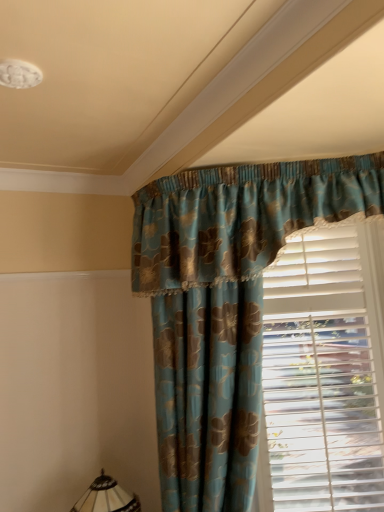
Measure the distance between point (195, 490) and camera.

A distance of 5.78 feet exists between point (195, 490) and camera.

Consider the image. In order to face white plastic blinds at right, should I rotate leftwards or rightwards?

To align with it, rotate right about 14.431°.

What do you see at coordinates (324, 373) in the screenshot? I see `white plastic blinds at right` at bounding box center [324, 373].

You are a GUI agent. You are given a task and a screenshot of the screen. Output one action in this format:
    pyautogui.click(x=<x>, y=<y>)
    Task: Click on the blue floral fabric curtain at center
    
    Given the screenshot: What is the action you would take?
    pyautogui.click(x=225, y=305)

Measure the distance between blue floral fabric curtain at center and translucent glass lampshade at lower left.

They are 34.32 inches apart.

Can you confirm if blue floral fabric curtain at center is positioned to the left of translucent glass lampshade at lower left?

No, blue floral fabric curtain at center is not to the left of translucent glass lampshade at lower left.

Which is more distant, (232, 454) or (108, 501)?

The point (108, 501) is behind.

Locate an element on the screen. This screenshot has height=512, width=384. table lamp lying behind the blue floral fabric curtain at center is located at coordinates (106, 497).

Which of these two, translucent glass lampshade at lower left or white plastic blinds at right, stands taller?

white plastic blinds at right is taller.

Considering the relative sizes of translucent glass lampshade at lower left and white plastic blinds at right in the image provided, is translucent glass lampshade at lower left smaller than white plastic blinds at right?

Yes, translucent glass lampshade at lower left is smaller than white plastic blinds at right.

Would you say translucent glass lampshade at lower left is to the left or to the right of white plastic blinds at right in the picture?

From the image, it's evident that translucent glass lampshade at lower left is to the left of white plastic blinds at right.

From a real-world perspective, which object stands above the other?

blue floral fabric curtain at center.

Can you confirm if white plastic blinds at right is wider than blue floral fabric curtain at center?

In fact, white plastic blinds at right might be narrower than blue floral fabric curtain at center.

Would you say white plastic blinds at right is a long distance from blue floral fabric curtain at center?

No, white plastic blinds at right is in close proximity to blue floral fabric curtain at center.

Does point (344, 276) come farther from viewer compared to point (227, 227)?

Yes, point (344, 276) is farther from viewer.

Which of these two, blue floral fabric curtain at center or white plastic blinds at right, is smaller?

white plastic blinds at right is smaller.

In the image, is blue floral fabric curtain at center positioned in front of or behind white plastic blinds at right?

blue floral fabric curtain at center is in front of white plastic blinds at right.

Locate an element on the screen. This screenshot has width=384, height=512. window blind on the right of the blue floral fabric curtain at center is located at coordinates (324, 373).

Can you confirm if blue floral fabric curtain at center is taller than white plastic blinds at right?

Indeed, blue floral fabric curtain at center has a greater height compared to white plastic blinds at right.

Can you confirm if white plastic blinds at right is bigger than translucent glass lampshade at lower left?

Yes.

Looking at this image, which of these two, white plastic blinds at right or translucent glass lampshade at lower left, stands shorter?

With less height is translucent glass lampshade at lower left.

Can translucent glass lampshade at lower left be found inside white plastic blinds at right?

No, translucent glass lampshade at lower left is not surrounded by white plastic blinds at right.

Can you tell me how much white plastic blinds at right and translucent glass lampshade at lower left differ in facing direction?

29 degrees separate the facing orientations of white plastic blinds at right and translucent glass lampshade at lower left.

Who is smaller, translucent glass lampshade at lower left or blue floral fabric curtain at center?

With smaller size is translucent glass lampshade at lower left.

Which of these two, translucent glass lampshade at lower left or blue floral fabric curtain at center, stands shorter?

translucent glass lampshade at lower left.

Is translucent glass lampshade at lower left to the right of blue floral fabric curtain at center from the viewer's perspective?

Incorrect, translucent glass lampshade at lower left is not on the right side of blue floral fabric curtain at center.

Locate an element on the screen. table lamp lying on the left of blue floral fabric curtain at center is located at coordinates (106, 497).

At what (x,y) coordinates should I click in order to perform the action: click on window blind behind the translucent glass lampshade at lower left. Please return your answer as a coordinate pair (x, y). The image size is (384, 512). Looking at the image, I should click on (324, 373).

Estimate the real-world distances between objects in this image. Which object is further from blue floral fabric curtain at center, translucent glass lampshade at lower left or white plastic blinds at right?

Based on the image, translucent glass lampshade at lower left appears to be further to blue floral fabric curtain at center.

Estimate the real-world distances between objects in this image. Which object is closer to white plastic blinds at right, blue floral fabric curtain at center or translucent glass lampshade at lower left?

Among the two, blue floral fabric curtain at center is located nearer to white plastic blinds at right.

Estimate the real-world distances between objects in this image. Which object is closer to translucent glass lampshade at lower left, blue floral fabric curtain at center or white plastic blinds at right?

Based on the image, blue floral fabric curtain at center appears to be nearer to translucent glass lampshade at lower left.

Based on their spatial positions, is white plastic blinds at right or blue floral fabric curtain at center further from translucent glass lampshade at lower left?

white plastic blinds at right is positioned further to the anchor translucent glass lampshade at lower left.

In the scene shown: Based on their spatial positions, is white plastic blinds at right or translucent glass lampshade at lower left closer to blue floral fabric curtain at center?

Among the two, white plastic blinds at right is located nearer to blue floral fabric curtain at center.

Estimate the real-world distances between objects in this image. Which object is closer to white plastic blinds at right, translucent glass lampshade at lower left or blue floral fabric curtain at center?

Among the two, blue floral fabric curtain at center is located nearer to white plastic blinds at right.

Identify the location of curtain between translucent glass lampshade at lower left and white plastic blinds at right. (225, 305).